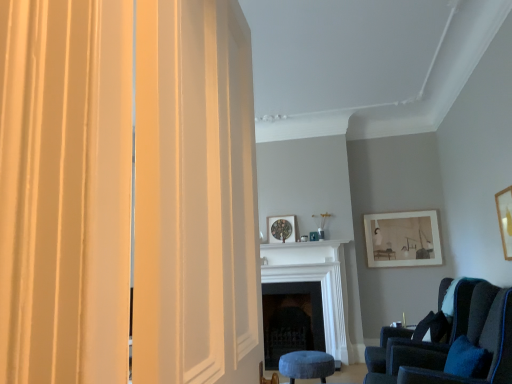
Question: Can you confirm if velvet blue stool at lower center is smaller than matte cream curtain at left?

Choices:
 (A) no
 (B) yes

Answer: (B)

Question: Does velvet blue stool at lower center come behind matte cream curtain at left?

Choices:
 (A) yes
 (B) no

Answer: (A)

Question: Is velvet blue stool at lower center directly adjacent to matte cream curtain at left?

Choices:
 (A) yes
 (B) no

Answer: (B)

Question: Is velvet blue stool at lower center bigger than matte cream curtain at left?

Choices:
 (A) no
 (B) yes

Answer: (A)

Question: Is velvet blue stool at lower center looking in the opposite direction of matte cream curtain at left?

Choices:
 (A) no
 (B) yes

Answer: (A)

Question: From the image's perspective, is velvet blue stool at lower center over matte cream curtain at left?

Choices:
 (A) no
 (B) yes

Answer: (A)

Question: Is matte wooden picture frame at upper right, which ranks as the second picture frame in right-to-left order, at the left side of velvet dark blue chair at lower right?

Choices:
 (A) no
 (B) yes

Answer: (A)

Question: From the image's perspective, is matte wooden picture frame at upper right, the 2th picture frame viewed from the back, located beneath velvet dark blue chair at lower right?

Choices:
 (A) no
 (B) yes

Answer: (A)

Question: Does matte wooden picture frame at upper right, the second picture frame in the left-to-right sequence, have a smaller size compared to velvet dark blue chair at lower right?

Choices:
 (A) yes
 (B) no

Answer: (A)

Question: Does matte wooden picture frame at upper right, which ranks as the second picture frame in right-to-left order, come in front of velvet dark blue chair at lower right?

Choices:
 (A) no
 (B) yes

Answer: (A)

Question: Can you confirm if matte wooden picture frame at upper right, the second picture frame in the left-to-right sequence, is taller than velvet dark blue chair at lower right?

Choices:
 (A) no
 (B) yes

Answer: (B)

Question: Is matte wooden picture frame at upper right, the second picture frame in the left-to-right sequence, thinner than velvet dark blue chair at lower right?

Choices:
 (A) yes
 (B) no

Answer: (A)

Question: Is dark wood fireplace at center, marked as the second fireplace in a front-to-back arrangement, far away from matte wooden picture frame at upper right, the 2th picture frame viewed from the back?

Choices:
 (A) yes
 (B) no

Answer: (A)